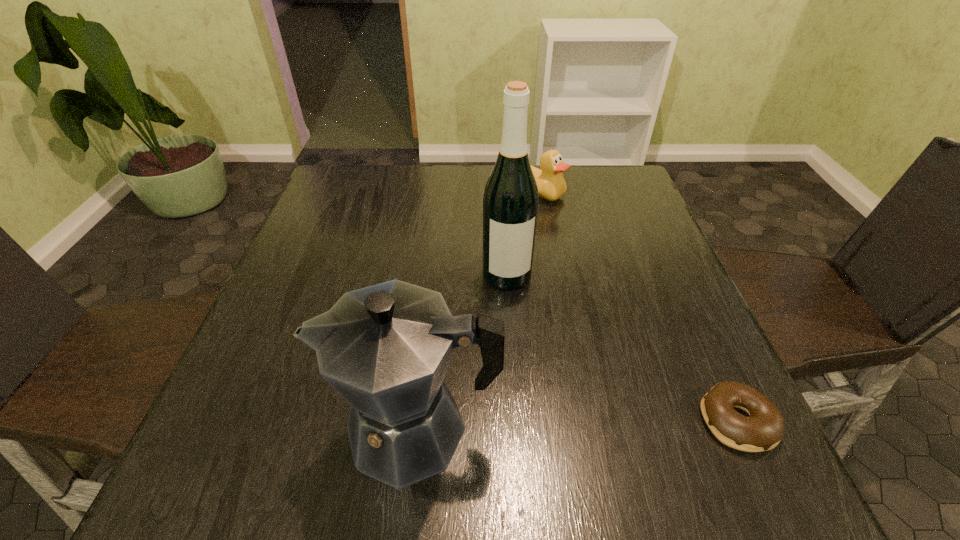
At what (x,y) coordinates should I click in order to perform the action: click on object at the right edge. Please return your answer as a coordinate pair (x, y). Looking at the image, I should click on (763, 429).

Find the location of a particular element. object that is at the near right corner is located at coordinates (763, 429).

You are a GUI agent. You are given a task and a screenshot of the screen. Output one action in this format:
    pyautogui.click(x=<x>, y=<y>)
    Task: Click on the free region at the far edge of the desktop
    The image size is (960, 540).
    Given the screenshot: What is the action you would take?
    pyautogui.click(x=412, y=188)

At what (x,y) coordinates should I click in order to perform the action: click on vacant area at the left edge. Please return your answer as a coordinate pair (x, y). The image size is (960, 540). Looking at the image, I should click on (330, 213).

In order to click on free space at the right edge of the desktop in this screenshot , I will do `click(684, 358)`.

Find the location of a particular element. empty space between the doughnut and the third tallest object is located at coordinates (637, 307).

Identify the location of blank region between the doughnut and the coffeepot. (577, 424).

The width and height of the screenshot is (960, 540). Identify the location of empty location between the second farthest object and the shortest object. (622, 348).

Locate an element on the screen. The height and width of the screenshot is (540, 960). free area in between the coffeepot and the doughnut is located at coordinates (577, 424).

Locate an element on the screen. Image resolution: width=960 pixels, height=540 pixels. vacant area that lies between the coffeepot and the third tallest object is located at coordinates (477, 310).